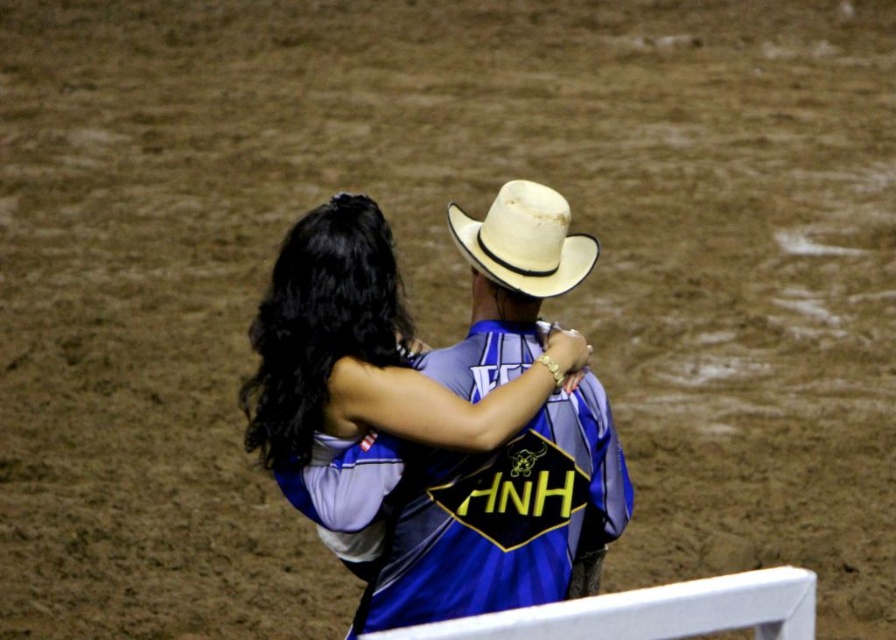
Can you confirm if matte blue jersey at center is wider than white straw cowboy hat at upper center?

Correct, the width of matte blue jersey at center exceeds that of white straw cowboy hat at upper center.

Is matte blue jersey at center shorter than white straw cowboy hat at upper center?

Incorrect, matte blue jersey at center's height does not fall short of white straw cowboy hat at upper center's.

Is point (276, 268) positioned in front of point (533, 216)?

No.

The image size is (896, 640). Find the location of `matte blue jersey at center`. matte blue jersey at center is located at coordinates (362, 380).